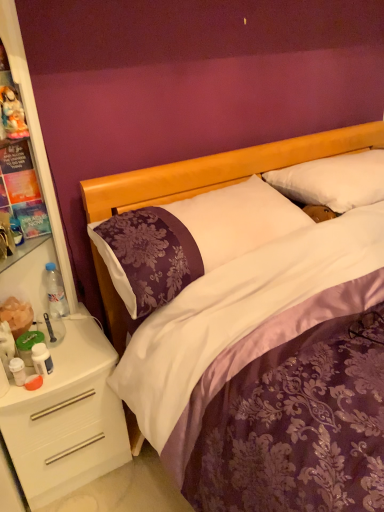
Question: Considering the positions of point (16, 133) and point (59, 280), is point (16, 133) closer or farther from the camera than point (59, 280)?

Choices:
 (A) farther
 (B) closer

Answer: (B)

Question: Is matte plastic figurine at upper left inside or outside of clear plastic bottle at left?

Choices:
 (A) inside
 (B) outside

Answer: (B)

Question: Which object is the farthest from the white plastic dresser at left?

Choices:
 (A) white plastic drawer at lower left
 (B) white soft pillow at upper center, marked as the first pillow in a right-to-left arrangement
 (C) purple satin pillow at center, positioned as the 1th pillow in left-to-right order
 (D) clear plastic bottle at left
 (E) matte plastic figurine at upper left

Answer: (B)

Question: Estimate the real-world distances between objects in this image. Which object is farther from the white plastic dresser at left?

Choices:
 (A) matte plastic figurine at upper left
 (B) purple satin pillow at center, marked as the 2th pillow in a right-to-left arrangement
 (C) white plastic drawer at lower left
 (D) clear plastic bottle at left
 (E) white soft pillow at upper center, which is counted as the second pillow, starting from the left

Answer: (E)